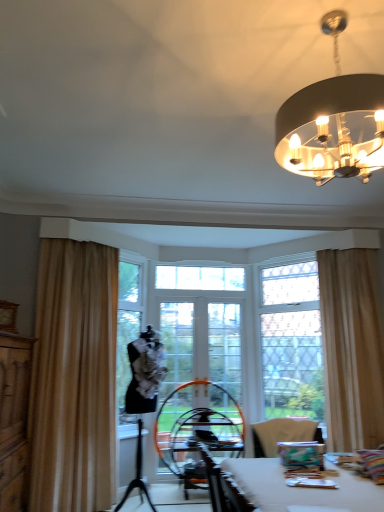
Question: Is the surface of beige fabric curtain at left, which is the 2th curtain from right to left, in direct contact with clear glass screen door at center?

Choices:
 (A) yes
 (B) no

Answer: (B)

Question: Is beige fabric curtain at left, the first curtain from the left, closer to the viewer compared to clear glass screen door at center?

Choices:
 (A) no
 (B) yes

Answer: (B)

Question: From the image's perspective, is beige fabric curtain at left, the first curtain from the left, above clear glass screen door at center?

Choices:
 (A) yes
 (B) no

Answer: (A)

Question: From a real-world perspective, does beige fabric curtain at left, which is the 2th curtain from right to left, sit lower than clear glass screen door at center?

Choices:
 (A) yes
 (B) no

Answer: (B)

Question: Is beige fabric curtain at left, the first curtain from the left, further to the viewer compared to clear glass screen door at center?

Choices:
 (A) yes
 (B) no

Answer: (B)

Question: From the image's perspective, is black leather swivel chair at center located above or below beige fabric curtain at right, the first curtain when ordered from right to left?

Choices:
 (A) below
 (B) above

Answer: (A)

Question: Considering the positions of black leather swivel chair at center and beige fabric curtain at right, arranged as the 2th curtain when viewed from the left, in the image, is black leather swivel chair at center taller or shorter than beige fabric curtain at right, arranged as the 2th curtain when viewed from the left,?

Choices:
 (A) tall
 (B) short

Answer: (B)

Question: Looking at the image, does black leather swivel chair at center seem bigger or smaller compared to beige fabric curtain at right, arranged as the 2th curtain when viewed from the left?

Choices:
 (A) small
 (B) big

Answer: (A)

Question: In the image, is black leather swivel chair at center positioned in front of or behind beige fabric curtain at right, the first curtain when ordered from right to left?

Choices:
 (A) front
 (B) behind

Answer: (B)

Question: From the image's perspective, relative to beige fabric curtain at left, the first curtain from the left, is clear glass screen door at center above or below?

Choices:
 (A) above
 (B) below

Answer: (B)

Question: Looking at the image, does clear glass screen door at center seem bigger or smaller compared to beige fabric curtain at left, the first curtain from the left?

Choices:
 (A) big
 (B) small

Answer: (B)

Question: In the image, is clear glass screen door at center positioned in front of or behind beige fabric curtain at left, which is the 2th curtain from right to left?

Choices:
 (A) front
 (B) behind

Answer: (B)

Question: From a real-world perspective, is clear glass screen door at center positioned above or below beige fabric curtain at left, which is the 2th curtain from right to left?

Choices:
 (A) below
 (B) above

Answer: (A)

Question: In terms of size, does wooden dresser at left appear bigger or smaller than matte black chandelier at upper right?

Choices:
 (A) small
 (B) big

Answer: (B)

Question: From a real-world perspective, relative to matte black chandelier at upper right, is wooden dresser at left vertically above or below?

Choices:
 (A) below
 (B) above

Answer: (A)